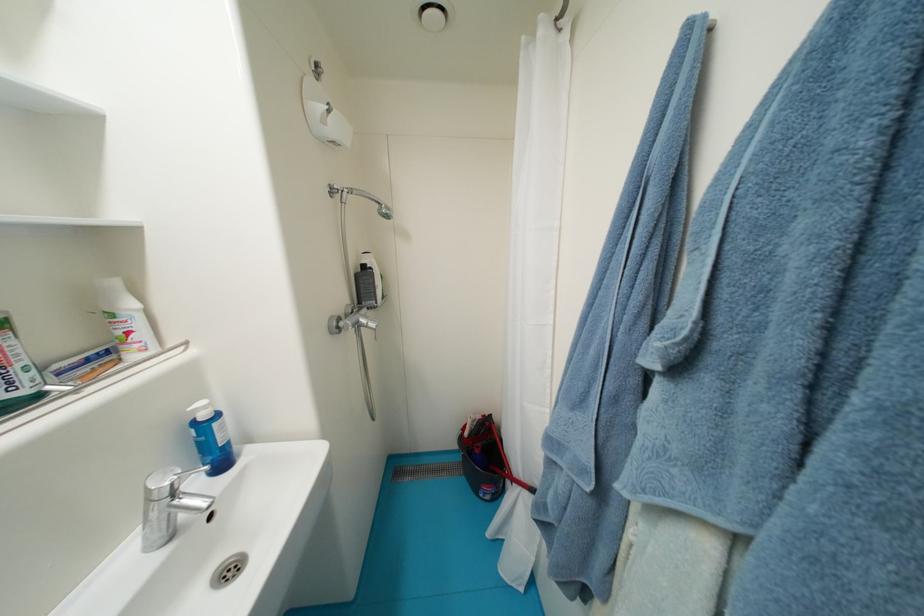
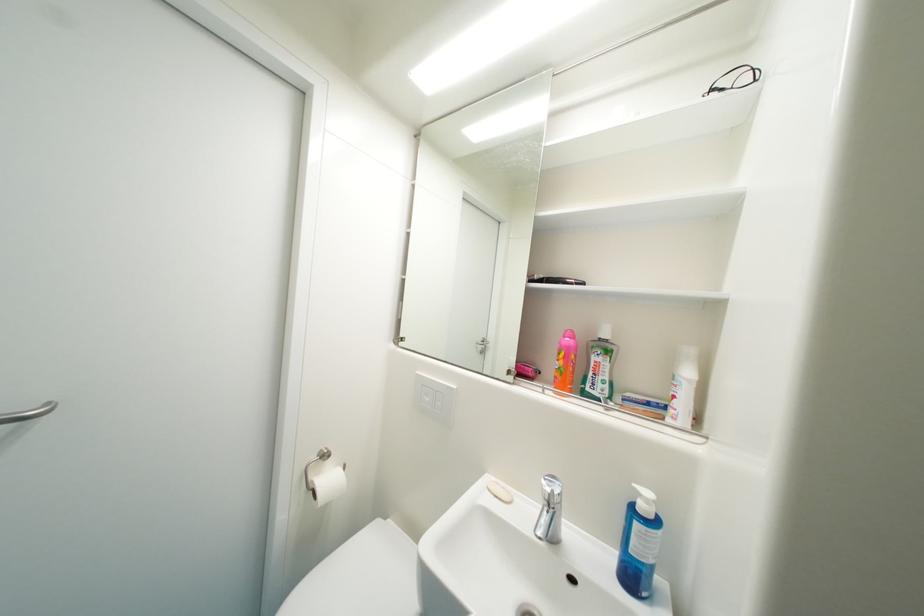
Find the pixel in the second image that matches point (200, 426) in the first image.

(641, 507)